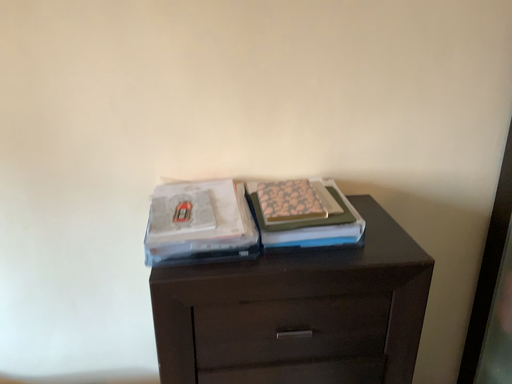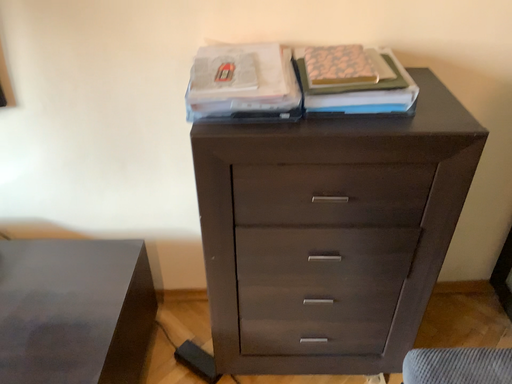
Question: How did the camera likely rotate when shooting the video?

Choices:
 (A) rotated right
 (B) rotated left

Answer: (B)